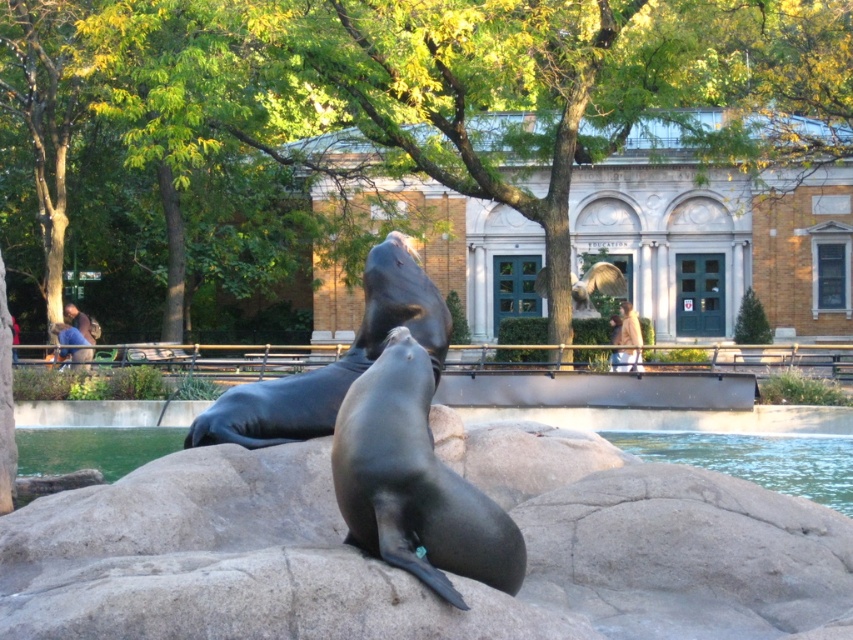
Question: Which point is farther to the camera?

Choices:
 (A) shiny black seal at center
 (B) black rubber seal at center

Answer: (B)

Question: Is shiny black seal at center smaller than black rubber seal at center?

Choices:
 (A) yes
 (B) no

Answer: (B)

Question: Is the position of shiny black seal at center less distant than that of black rubber seal at center?

Choices:
 (A) yes
 (B) no

Answer: (A)

Question: Which point is farther to the camera?

Choices:
 (A) pos(793,438)
 (B) pos(263,384)

Answer: (A)

Question: Which object appears farthest from the camera in this image?

Choices:
 (A) black rubber seal at center
 (B) shiny black seal at center

Answer: (A)

Question: Is the position of shiny black seal at center more distant than that of black rubber seal at center?

Choices:
 (A) no
 (B) yes

Answer: (A)